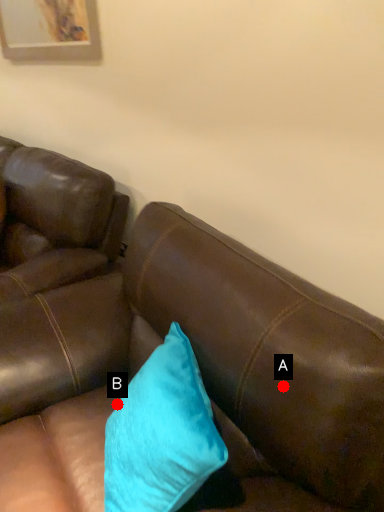
Question: Two points are circled on the image, labeled by A and B beside each circle. Among these points, which one is nearest to the camera?

Choices:
 (A) A is closer
 (B) B is closer

Answer: (A)